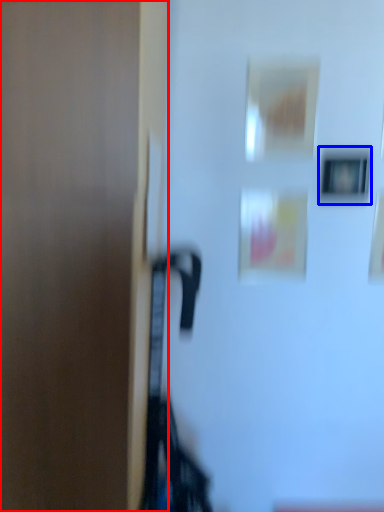
Question: Which of the following is the farthest to the observer, door (highlighted by a red box) or picture frame (highlighted by a blue box)?

Choices:
 (A) door
 (B) picture frame

Answer: (B)